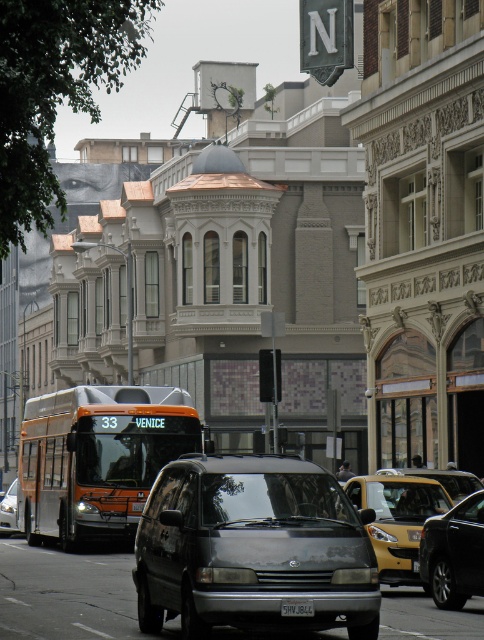
You are a pedestrian standing on the sidewalk and see both the yellow metallic taxi at center and the shiny black sedan at center. Which vehicle is closer to your left side?

The yellow metallic taxi at center is closer to your left side because it is positioned to the left of the shiny black sedan at center.

You are a delivery driver who needs to park your metallic gray van at center in a specific spot. The parking spot is located at coordinates point 0.856, 0.523. Is your van currently in the correct parking spot?

Yes, the metallic gray van at center is already positioned at point (253, 547), which matches the coordinates of the parking spot.